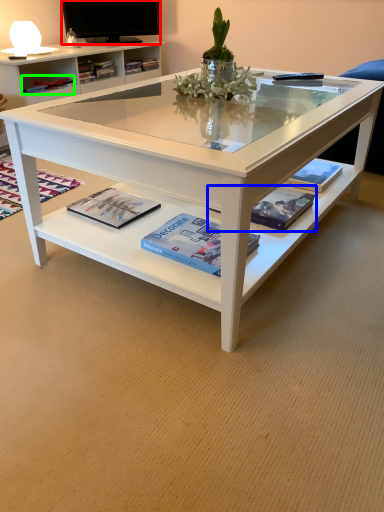
Question: Which is nearer to the television (highlighted by a red box)? magazine (highlighted by a blue box) or book (highlighted by a green box).

Choices:
 (A) magazine
 (B) book

Answer: (B)